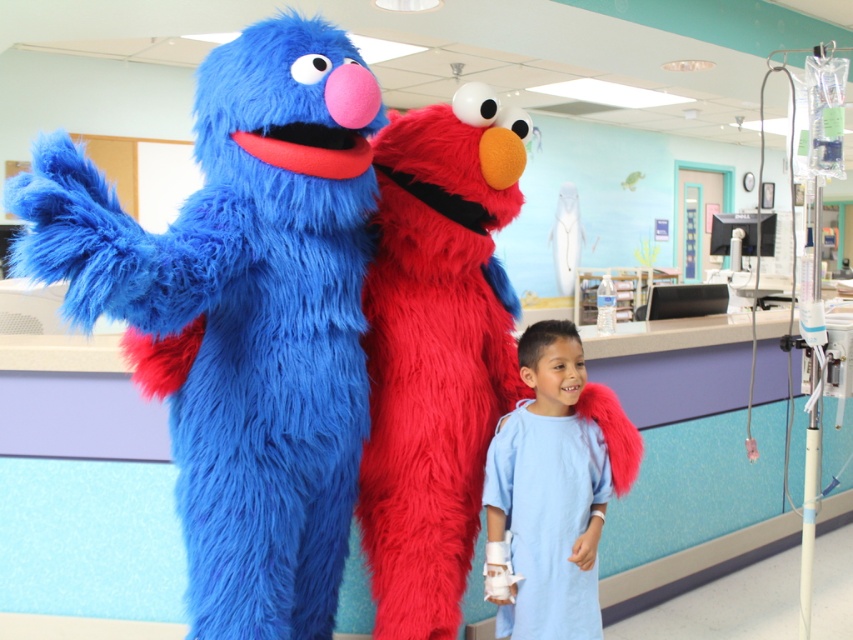
Where is the fluffy red elmo at center located in the image?

→ The fluffy red elmo at center is located at point (434, 349).

You are a nurse in the hospital. You need to place a medical chart at point (235, 636). The chart is 1.5 meters wide. Can you fit it there?

The point (235, 636) is 1.61 meters away from the camera. The chart is 1.5 meters wide, so it can fit there since the distance is greater than the chart width.